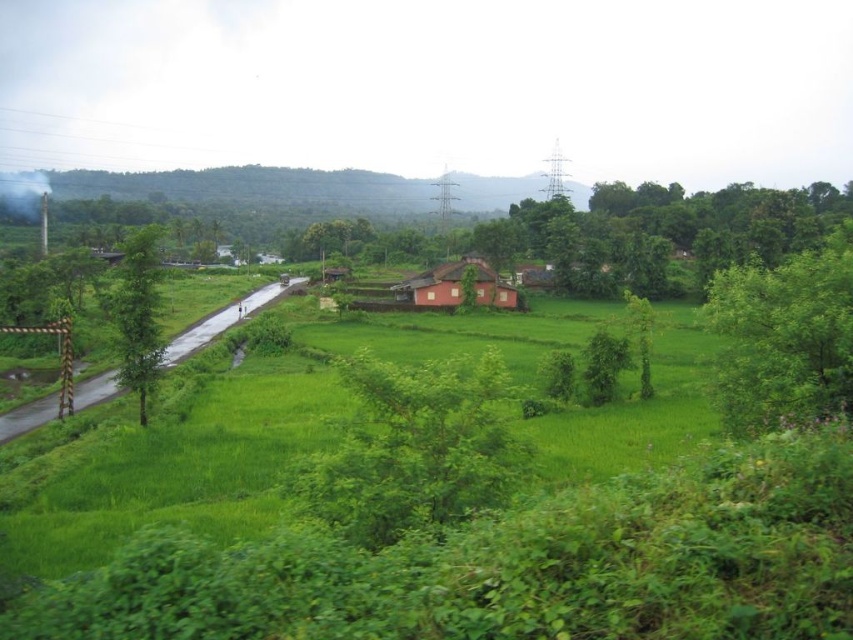
You are a photographer planning to capture a landscape photo that includes both the green leafy tree at left and the matte pink house at center. Based on their sizes, which object should you focus on to ensure both are clearly visible in the frame?

The green leafy tree at left is larger in size than the matte pink house at center, so focusing on the larger tree would help ensure both are visible in the frame.